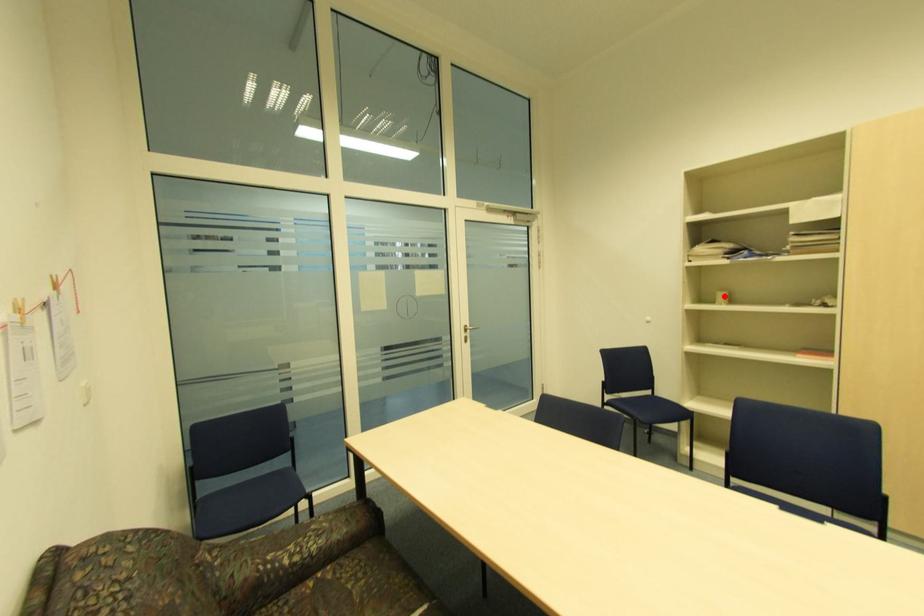
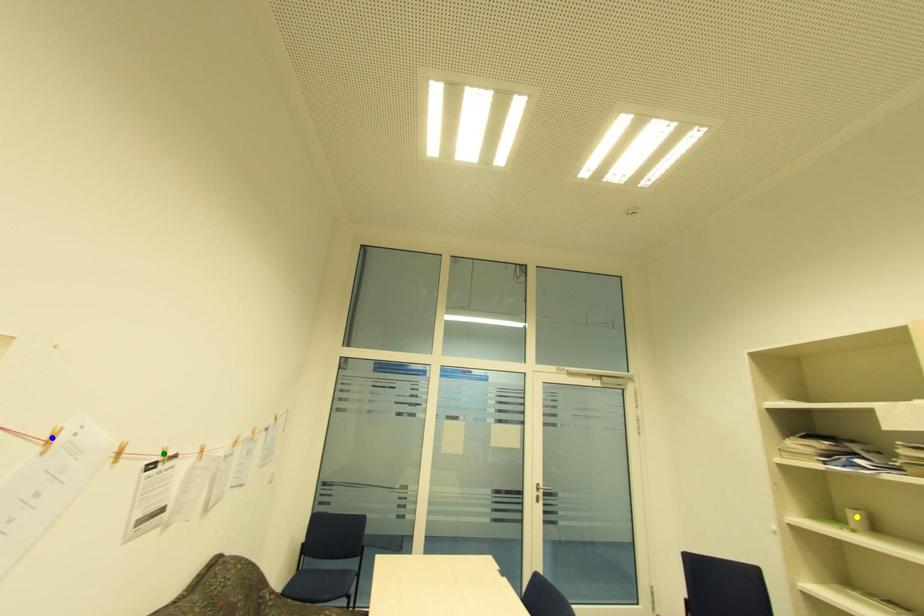
Question: I am providing you with two images of the same scene from different viewpoints. A red point is marked on the first image. You are given multiple points on the second image. In image 2, which mark is for the same physical point as the one in image 1?

Choices:
 (A) yellow point
 (B) green point
 (C) blue point

Answer: (A)